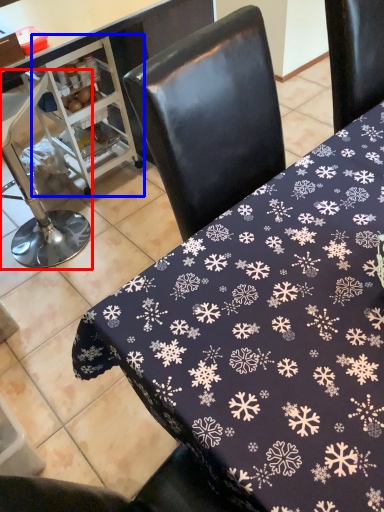
Question: Which point is closer to the camera, chair (highlighted by a red box) or appliance (highlighted by a blue box)?

Choices:
 (A) chair
 (B) appliance

Answer: (A)